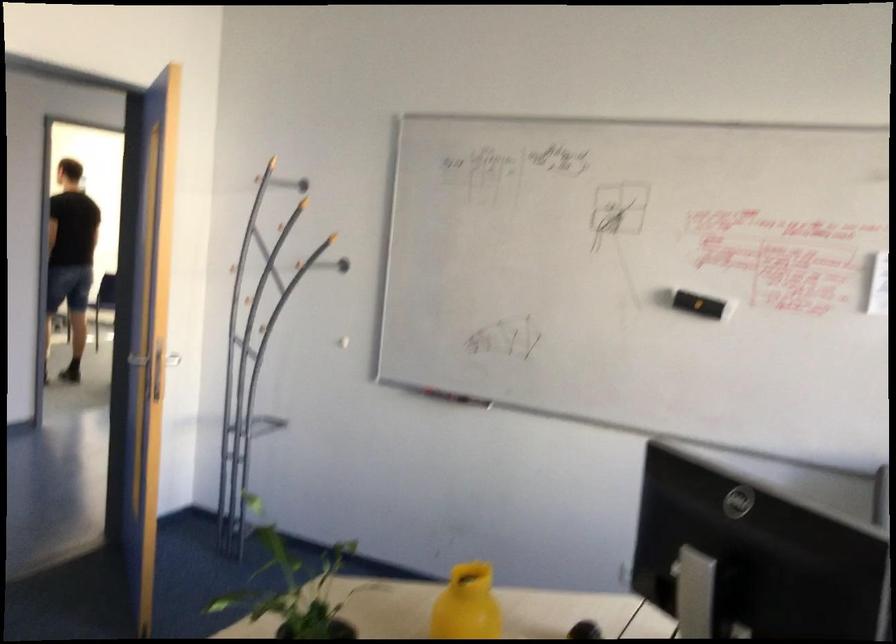
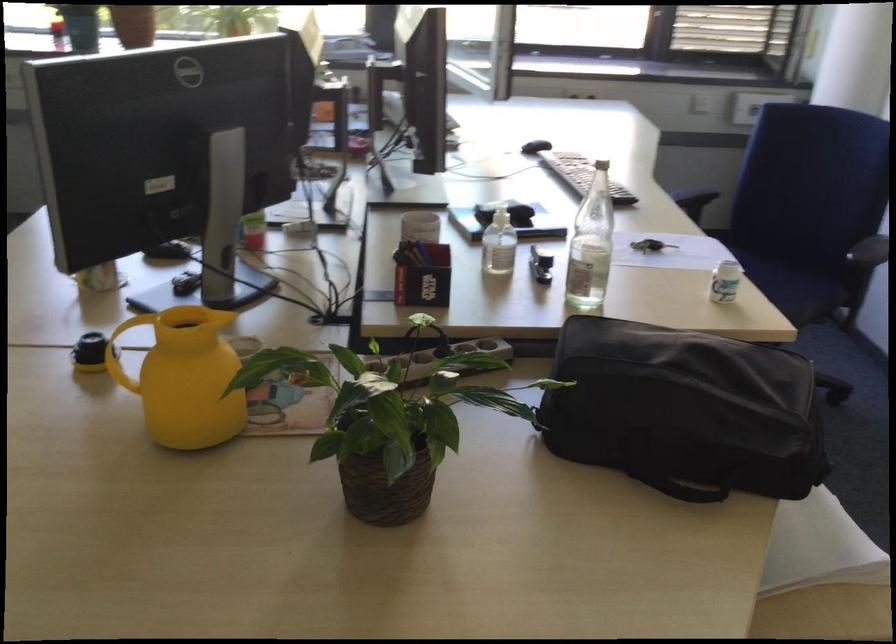
Question: I am providing you with two images of the same scene from different viewpoints. Which of the following objects are not visible in image2?

Choices:
 (A) black bottle crate
 (B) black stapler
 (C) small plant pot
 (D) black lens cap

Answer: (C)